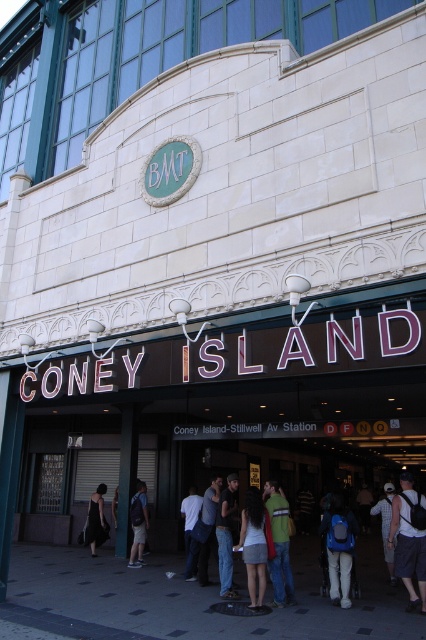
You are at Coney Island Station and see a person wearing a green sweater at center and a black dress at center. Which clothing item takes up more space on the person?

The black dress at center takes up more space than the green sweater at center because the green sweater at center occupies less space.

You are a fashion designer observing the scene at Coney Island Station. You notice a green sweater at center and a black dress at center. Which clothing item is covering part of the other?

The green sweater at center is positioned over the black dress at center, meaning it is covering part of the black dress at center.